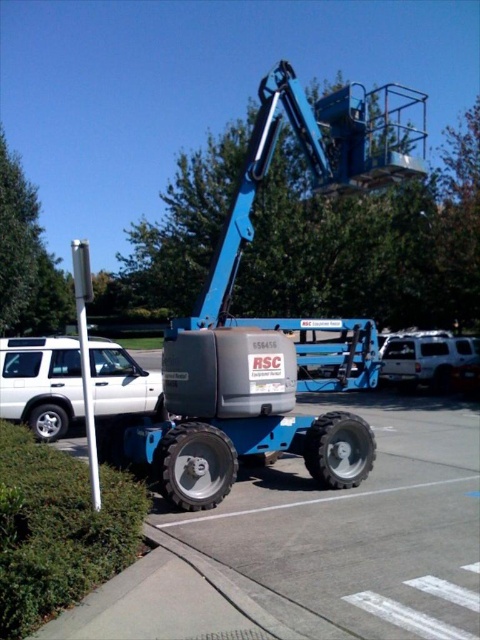
Question: Does white matte suv at lower left come in front of white matte suv at right?

Choices:
 (A) yes
 (B) no

Answer: (A)

Question: Is white matte suv at lower left above white matte suv at right?

Choices:
 (A) yes
 (B) no

Answer: (A)

Question: Which point appears closest to the camera in this image?

Choices:
 (A) (442, 376)
 (B) (78, 394)

Answer: (B)

Question: Which point is closer to the camera taking this photo?

Choices:
 (A) (116, 406)
 (B) (471, 346)

Answer: (A)

Question: Is white matte suv at lower left wider than white matte suv at right?

Choices:
 (A) no
 (B) yes

Answer: (A)